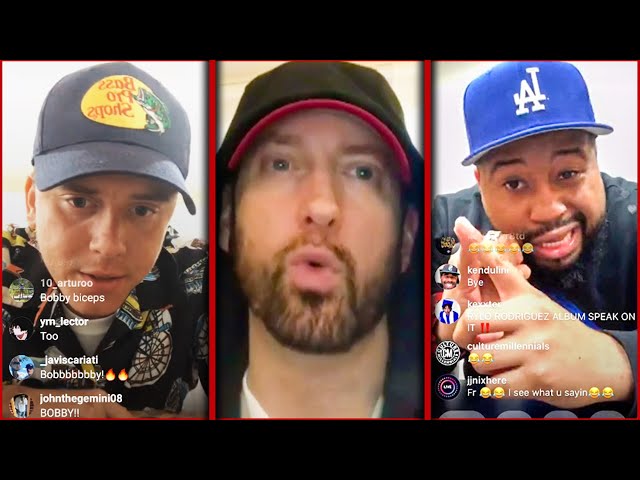
Image resolution: width=640 pixels, height=480 pixels. Find the location of `yellow decal`. yellow decal is located at coordinates (131, 117).